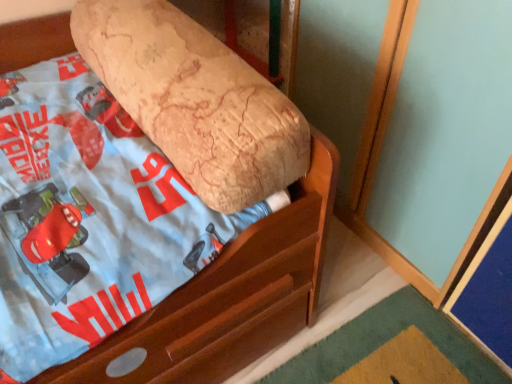
Identify the location of textured brown sleeping bag at center. The height and width of the screenshot is (384, 512). (195, 100).

In order to face textured brown sleeping bag at center, should I rotate leftwards or rightwards?

You should look left and rotate roughly 11.765 degrees.

The width and height of the screenshot is (512, 384). Describe the element at coordinates (195, 100) in the screenshot. I see `textured brown sleeping bag at center` at that location.

I want to click on textured brown sleeping bag at center, so click(x=195, y=100).